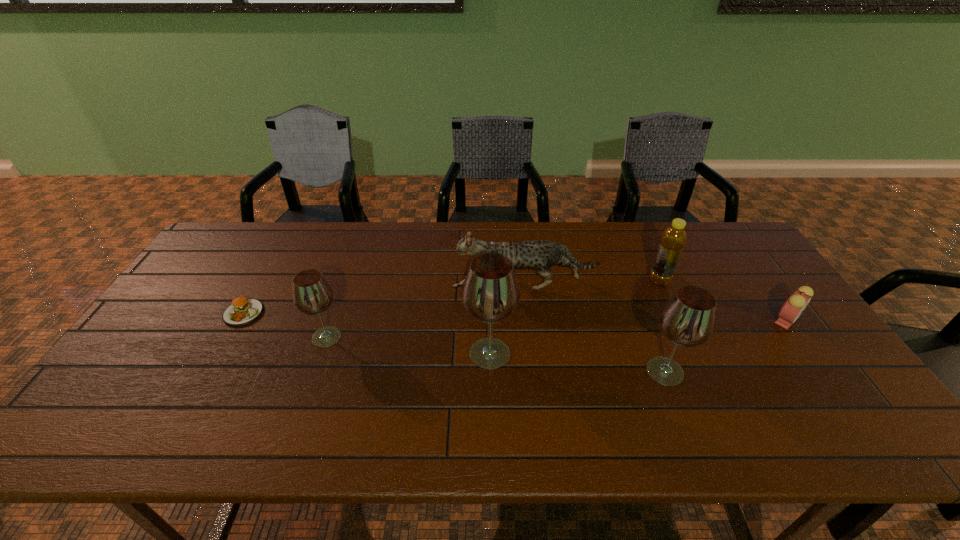
Please point a free position for a wineglass on the right. Please provide its 2D coordinates. Your answer should be formatted as a tuple, i.e. [(x, y)], where the tuple contains the x and y coordinates of a point satisfying the conditions above.

[(854, 390)]